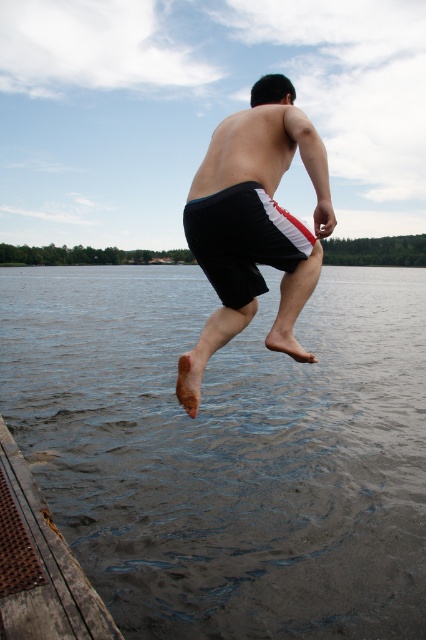
Does black cotton shorts at center have a larger size compared to rusty wood dock at lower left?

Incorrect, black cotton shorts at center is not larger than rusty wood dock at lower left.

Consider the image. Is black cotton shorts at center wider than rusty wood dock at lower left?

No, black cotton shorts at center is not wider than rusty wood dock at lower left.

Does point (310, 170) lie in front of point (0, 468)?

That is True.

At what (x,y) coordinates should I click in order to perform the action: click on black cotton shorts at center. Please return your answer as a coordinate pair (x, y). The image size is (426, 640). Looking at the image, I should click on (253, 225).

Which is above, black cotton shorts at center or black fabric shorts at center?

black cotton shorts at center is above.

Does point (308, 268) lie behind point (206, 211)?

Yes, point (308, 268) is behind point (206, 211).

This screenshot has width=426, height=640. Find the location of `black cotton shorts at center`. black cotton shorts at center is located at coordinates (253, 225).

From the picture: Can you confirm if dark gray water at lower center is positioned above black cotton shorts at center?

Yes.

Image resolution: width=426 pixels, height=640 pixels. I want to click on dark gray water at lower center, so click(x=227, y=451).